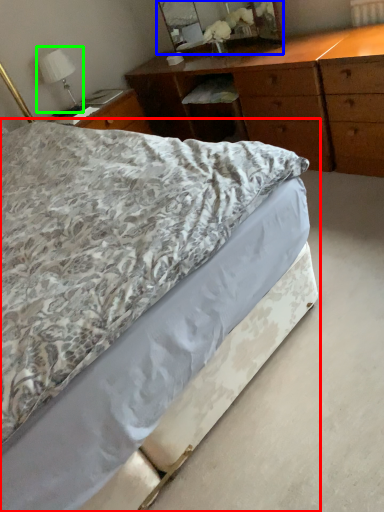
Question: Estimate the real-world distances between objects in this image. Which object is closer to bed (highlighted by a red box), mirror (highlighted by a blue box) or bedside lamp (highlighted by a green box)?

Choices:
 (A) mirror
 (B) bedside lamp

Answer: (B)